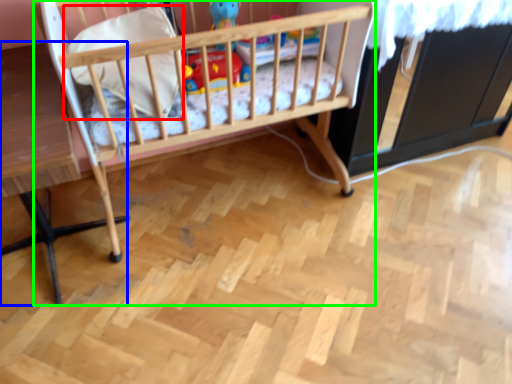
Question: Considering the real-world distances, which object is closest to pillow (highlighted by a red box)? table (highlighted by a blue box) or infant bed (highlighted by a green box).

Choices:
 (A) table
 (B) infant bed

Answer: (B)